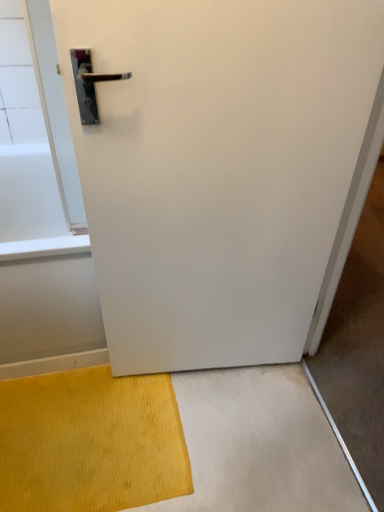
Identify the location of vacant space that is in between white matte door at center and yellow textured mat at lower left. This screenshot has width=384, height=512. (228, 423).